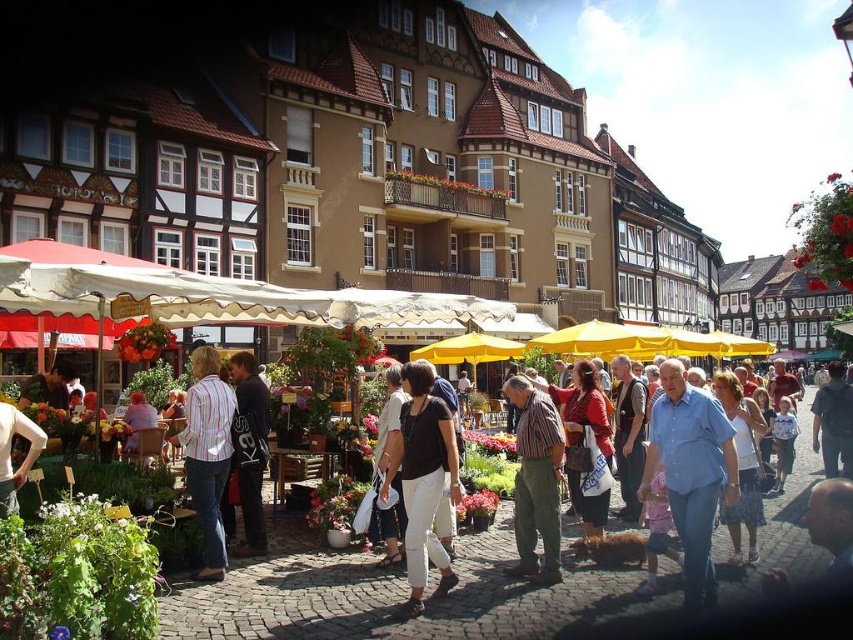
Question: Which point appears closest to the camera in this image?

Choices:
 (A) (415, 490)
 (B) (196, 349)

Answer: (A)

Question: Among these objects, which one is nearest to the camera?

Choices:
 (A) light blue cotton shirt at center
 (B) striped cotton shirt at center
 (C) striped fabric shirt at center
 (D) matte black shirt at center

Answer: (A)

Question: Which point is closer to the camera?

Choices:
 (A) dark gray hoodie at center
 (B) light blue cotton shirt at center
 (C) striped fabric shirt at center

Answer: (B)

Question: Does striped cotton shirt at center appear over dark gray hoodie at center?

Choices:
 (A) no
 (B) yes

Answer: (B)

Question: Does matte black shirt at center have a smaller size compared to striped fabric shirt at center?

Choices:
 (A) yes
 (B) no

Answer: (A)

Question: Is striped cotton shirt at center above dark gray hoodie at center?

Choices:
 (A) no
 (B) yes

Answer: (B)